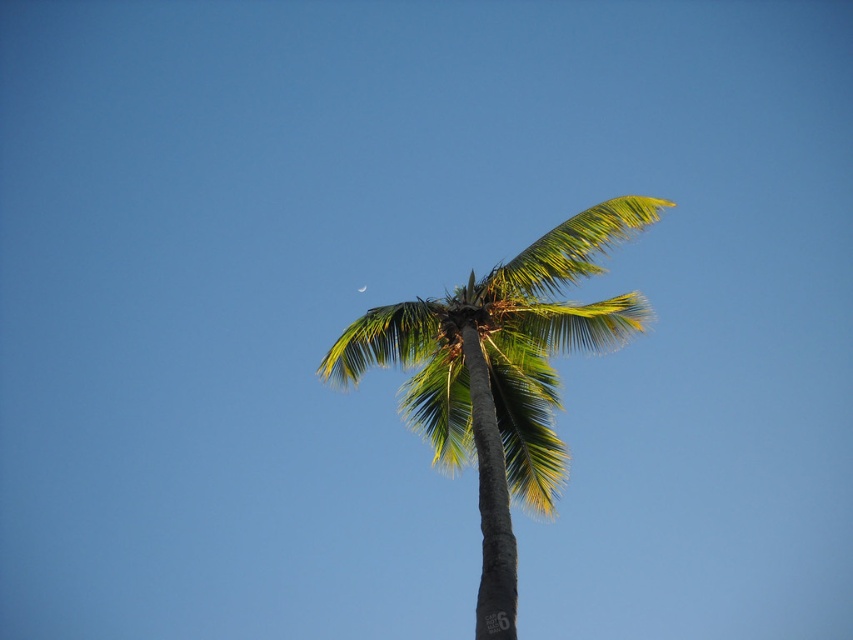
Question: Is green leafy coconut tree at center smaller than silvery reflective crescent at upper center?

Choices:
 (A) no
 (B) yes

Answer: (A)

Question: Does green leafy coconut tree at center have a smaller size compared to silvery reflective crescent at upper center?

Choices:
 (A) yes
 (B) no

Answer: (B)

Question: Among these objects, which one is nearest to the camera?

Choices:
 (A) silvery reflective crescent at upper center
 (B) green leafy coconut tree at center

Answer: (B)

Question: Does green leafy coconut tree at center appear on the left side of silvery reflective crescent at upper center?

Choices:
 (A) yes
 (B) no

Answer: (B)